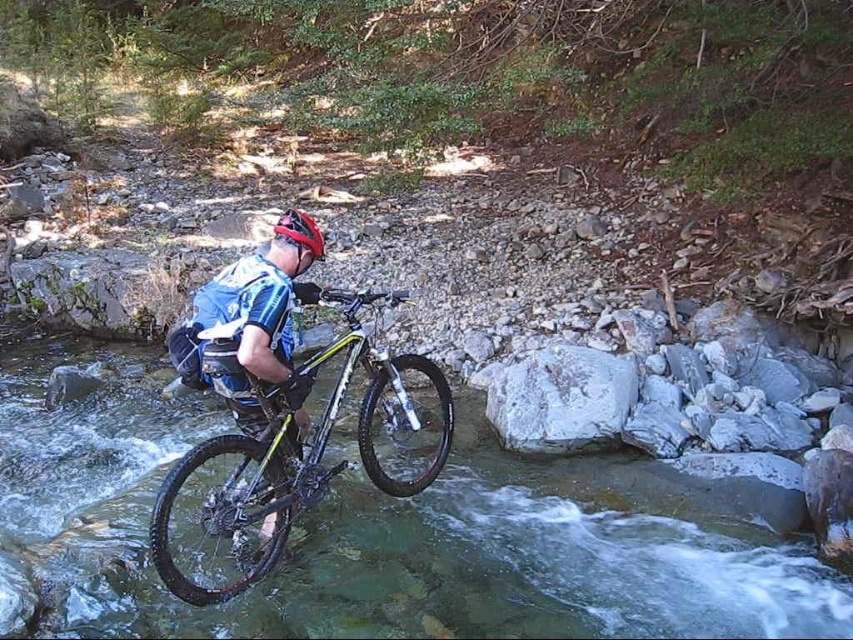
Where is the yellow matte bicycle at center located in the image?

The yellow matte bicycle at center is located at point (297, 454) in the image.

You are a mountain biker trying to cross the stream. You see the clear water at center and the white smooth rock at center. Which object should you step on first to safely cross the stream?

The white smooth rock at center is behind clear water at center, so you should step on the white smooth rock at center first to safely cross the stream.